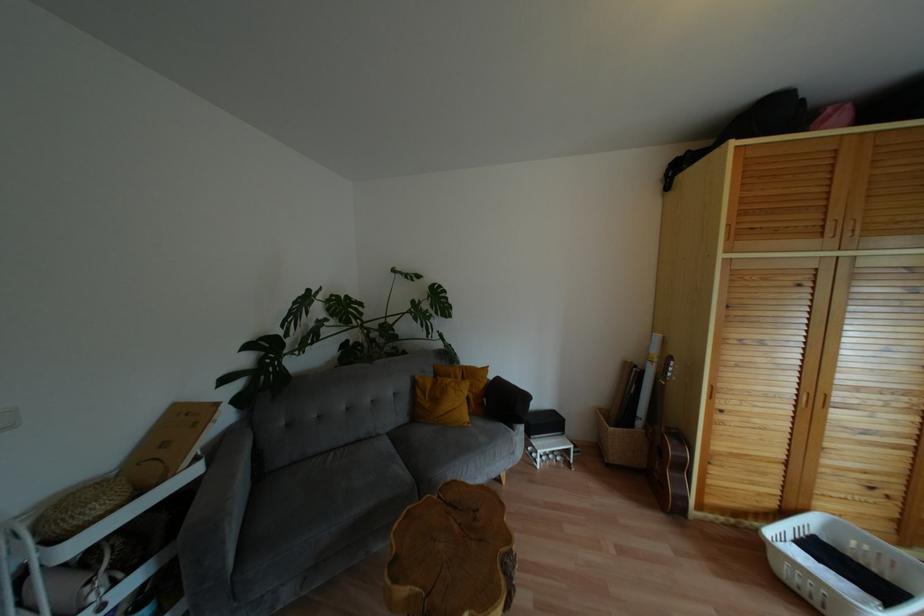
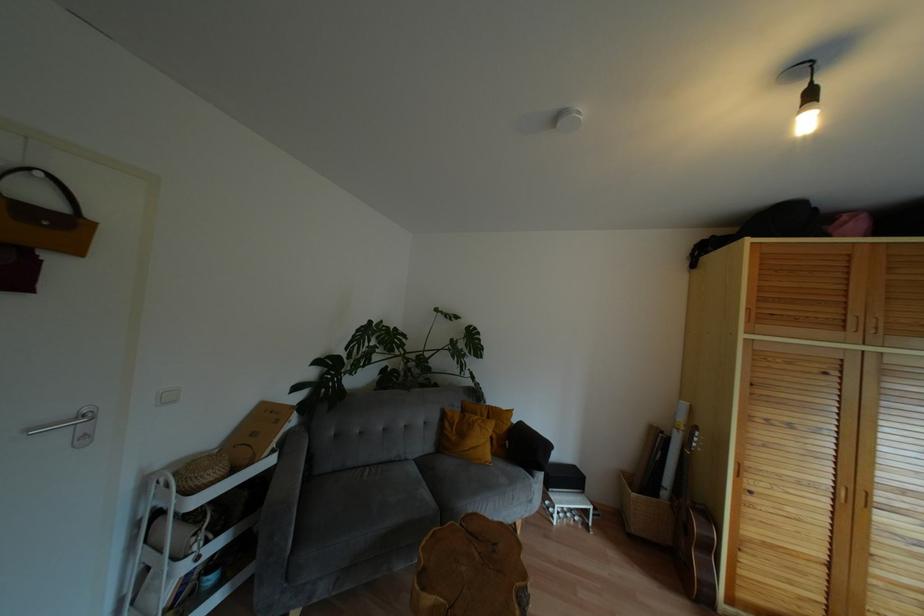
In the second image, find the point that corresponds to point 466,418 in the first image.

(488, 456)